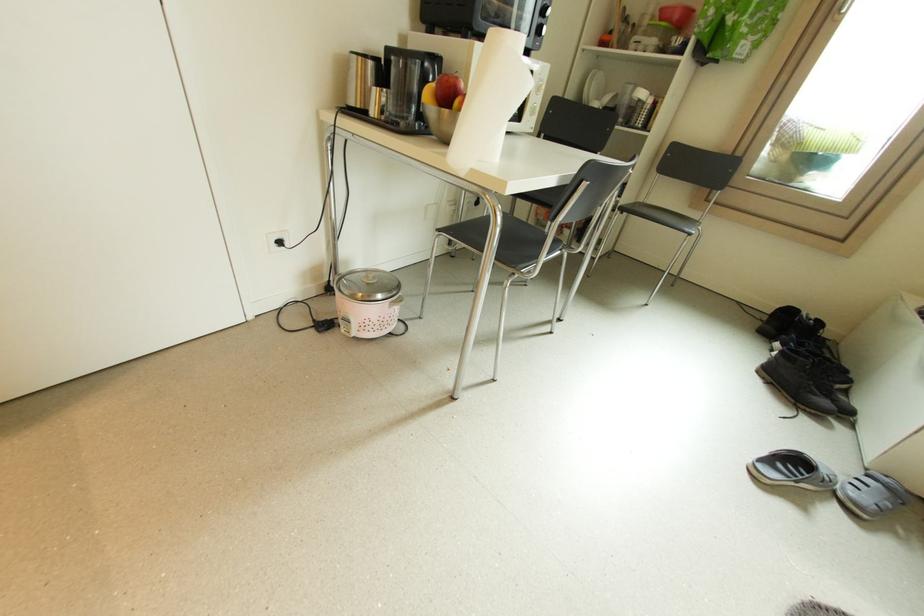
Identify the location of red apple. (447, 89).